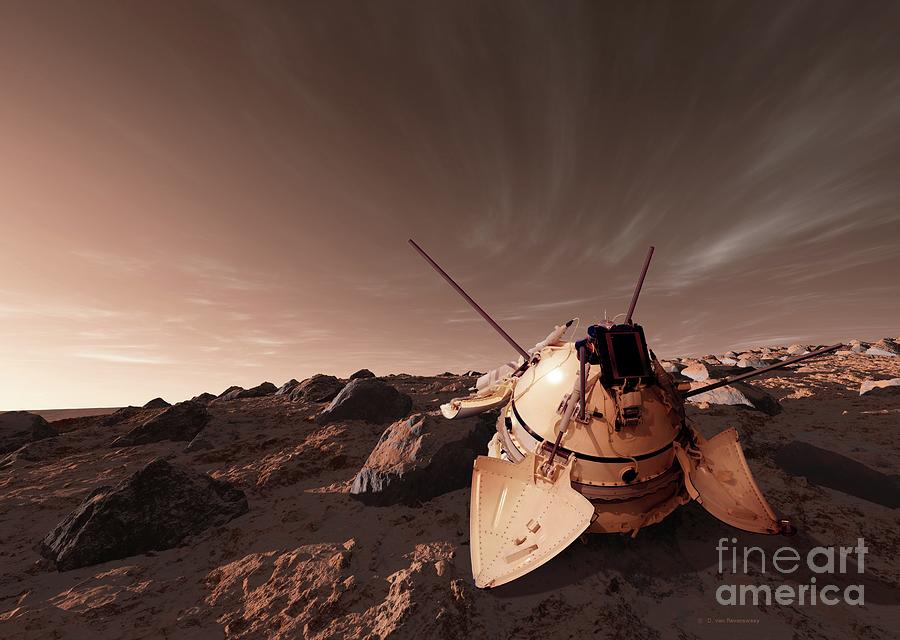
You are a GUI agent. You are given a task and a screenshot of the screen. Output one action in this format:
    pyautogui.click(x=<x>, y=<y>)
    Task: Click on the art
    
    Given the screenshot: What is the action you would take?
    pyautogui.click(x=833, y=560)